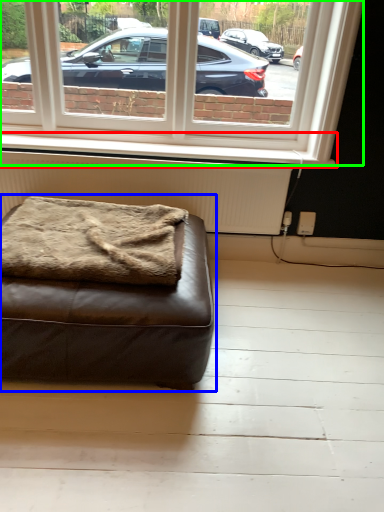
Question: Based on their relative distances, which object is farther from window sill (highlighted by a red box)? Choose from studio couch (highlighted by a blue box) and window (highlighted by a green box).

Choices:
 (A) studio couch
 (B) window

Answer: (A)